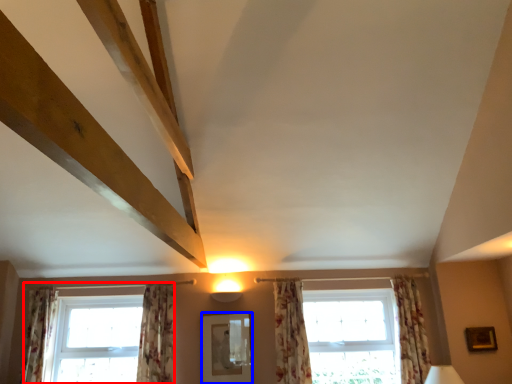
Question: Which point is closer to the camera, window (highlighted by a red box) or mirror (highlighted by a blue box)?

Choices:
 (A) window
 (B) mirror

Answer: (B)